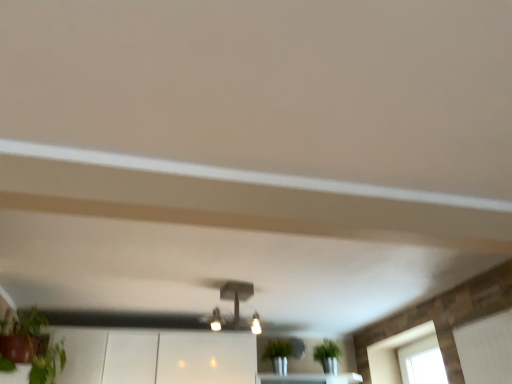
Question: Does matte black light fixture at center touch transparent glass window at lower right?

Choices:
 (A) no
 (B) yes

Answer: (A)

Question: Considering the relative sizes of matte black light fixture at center and transparent glass window at lower right in the image provided, is matte black light fixture at center shorter than transparent glass window at lower right?

Choices:
 (A) yes
 (B) no

Answer: (A)

Question: Does matte black light fixture at center appear on the right side of transparent glass window at lower right?

Choices:
 (A) no
 (B) yes

Answer: (A)

Question: Does matte black light fixture at center have a greater width compared to transparent glass window at lower right?

Choices:
 (A) yes
 (B) no

Answer: (A)

Question: Does matte black light fixture at center have a lesser width compared to transparent glass window at lower right?

Choices:
 (A) no
 (B) yes

Answer: (A)

Question: Considering the relative sizes of matte black light fixture at center and transparent glass window at lower right in the image provided, is matte black light fixture at center smaller than transparent glass window at lower right?

Choices:
 (A) yes
 (B) no

Answer: (A)

Question: Is matte black light fixture at center surrounded by transparent glass window at lower right?

Choices:
 (A) yes
 (B) no

Answer: (B)

Question: From a real-world perspective, does transparent glass window at lower right stand above matte black light fixture at center?

Choices:
 (A) yes
 (B) no

Answer: (B)

Question: Does transparent glass window at lower right appear on the left side of matte black light fixture at center?

Choices:
 (A) no
 (B) yes

Answer: (A)

Question: Considering the relative positions of transparent glass window at lower right and matte black light fixture at center in the image provided, is transparent glass window at lower right in front of matte black light fixture at center?

Choices:
 (A) no
 (B) yes

Answer: (A)

Question: Does transparent glass window at lower right have a greater width compared to matte black light fixture at center?

Choices:
 (A) no
 (B) yes

Answer: (A)

Question: Is the position of transparent glass window at lower right more distant than that of matte black light fixture at center?

Choices:
 (A) yes
 (B) no

Answer: (A)

Question: Is transparent glass window at lower right inside the boundaries of matte black light fixture at center, or outside?

Choices:
 (A) outside
 (B) inside

Answer: (A)